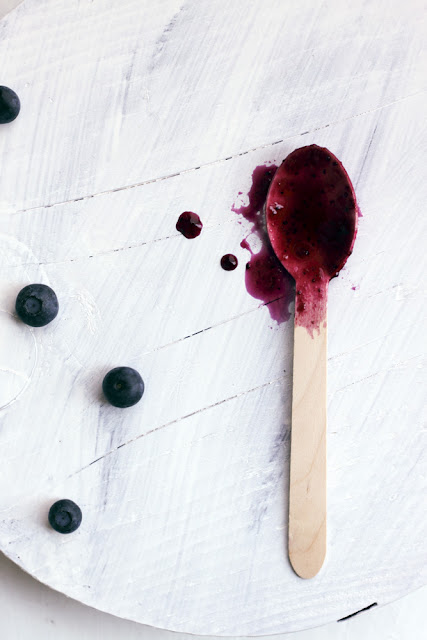
Locate an element on the screen. Image resolution: width=427 pixels, height=640 pixels. spoon is located at coordinates (304, 499).